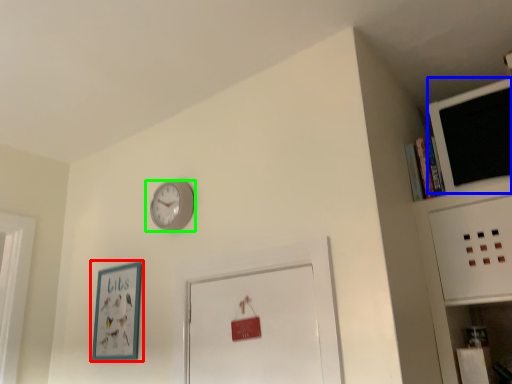
Question: Which object is positioned closest to picture frame (highlighted by a red box)? Select from computer monitor (highlighted by a blue box) and wall clock (highlighted by a green box).

Choices:
 (A) computer monitor
 (B) wall clock

Answer: (B)